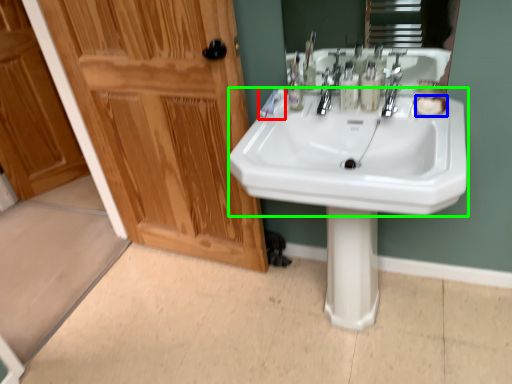
Question: Considering the real-world distances, which object is farthest from toothpaste (highlighted by a red box)? soap (highlighted by a blue box) or sink (highlighted by a green box)?

Choices:
 (A) soap
 (B) sink

Answer: (A)